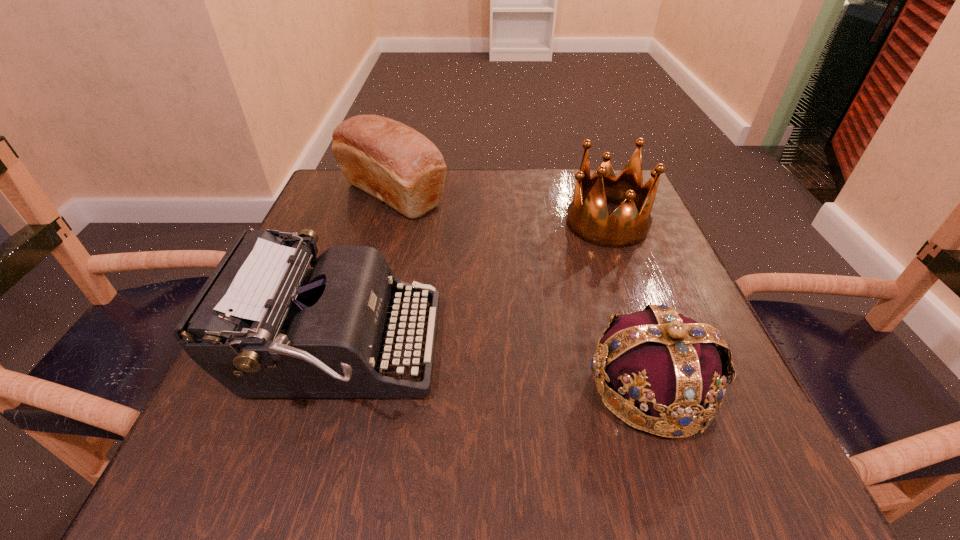
In order to click on free space at the left edge of the desktop in this screenshot , I will do `click(344, 230)`.

Find the location of `vacant space at the right edge of the desktop`. vacant space at the right edge of the desktop is located at coordinates (703, 316).

Locate an element on the screen. vacant area at the near left corner is located at coordinates (273, 437).

In the image, there is a desktop. Where is `free region at the near right corner`? free region at the near right corner is located at coordinates (727, 433).

Locate an element on the screen. This screenshot has height=540, width=960. blank region between the nearer crown and the farther crown is located at coordinates (629, 305).

I want to click on free space between the typewriter and the nearer crown, so click(x=494, y=368).

I want to click on unoccupied area between the nearer crown and the bread, so click(x=522, y=291).

You are a GUI agent. You are given a task and a screenshot of the screen. Output one action in this format:
    pyautogui.click(x=<x>, y=<y>)
    Task: Click on the free space that is in between the bread and the shorter crown
    The width and height of the screenshot is (960, 540).
    Given the screenshot: What is the action you would take?
    pyautogui.click(x=522, y=291)

The height and width of the screenshot is (540, 960). I want to click on empty space between the shorter crown and the bread, so click(522, 291).

You are a GUI agent. You are given a task and a screenshot of the screen. Output one action in this format:
    pyautogui.click(x=<x>, y=<y>)
    Task: Click on the free space between the nearer crown and the bread
    
    Given the screenshot: What is the action you would take?
    pyautogui.click(x=522, y=291)